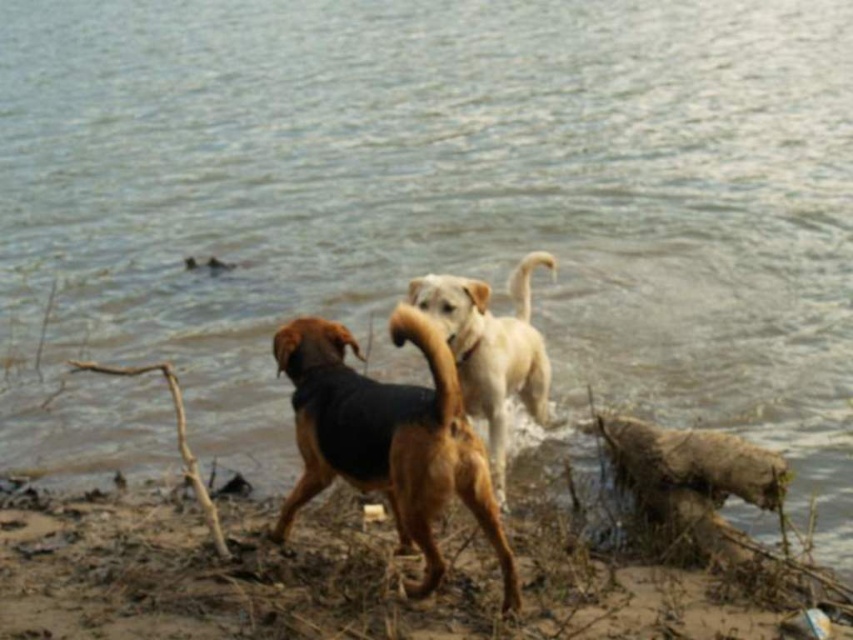
You are a photographer aiming to capture the brown dirt shoreline at lower left in your shot. Based on the scene description, where should you position your camera to ensure the shoreline is centered in the frame?

To center the brown dirt shoreline at lower left in the frame, position the camera so that the shoreline is located at the coordinates 0.909 on the x axis and 0.387 on the y axis.

You are a photographer trying to capture a photo of the two dogs in the riverside scene. You notice two points marked on your screen at coordinates point [440,424] and point [500,353]. Which point is closer to your camera lens?

Point [440,424] is closer to the camera than point [500,353].